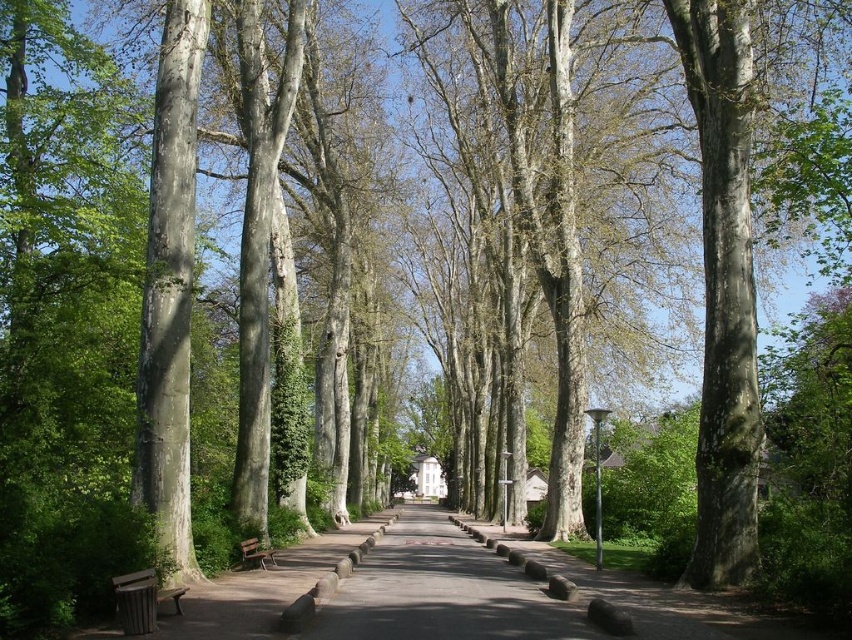
Question: Can you confirm if wooden bench at lower left is thinner than wooden park bench at center?

Choices:
 (A) no
 (B) yes

Answer: (B)

Question: Does wooden bench at lower left appear over wooden park bench at center?

Choices:
 (A) no
 (B) yes

Answer: (B)

Question: Which point is closer to the camera?

Choices:
 (A) (131, 593)
 (B) (250, 547)

Answer: (A)

Question: Among these objects, which one is farthest from the camera?

Choices:
 (A) wooden park bench at center
 (B) wooden bench at lower left

Answer: (A)

Question: Can you confirm if wooden bench at lower left is wider than wooden park bench at center?

Choices:
 (A) yes
 (B) no

Answer: (B)